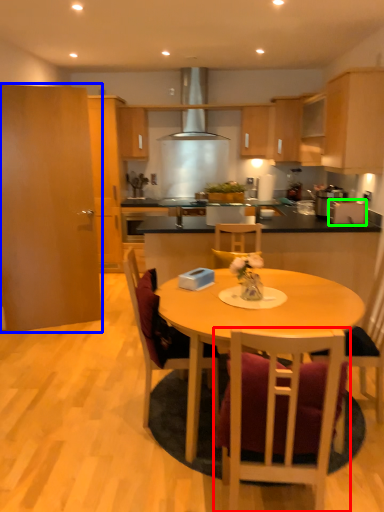
Question: Based on their relative distances, which object is nearer to chair (highlighted by a red box)? Choose from cabinetry (highlighted by a blue box) and appliance (highlighted by a green box).

Choices:
 (A) cabinetry
 (B) appliance

Answer: (B)